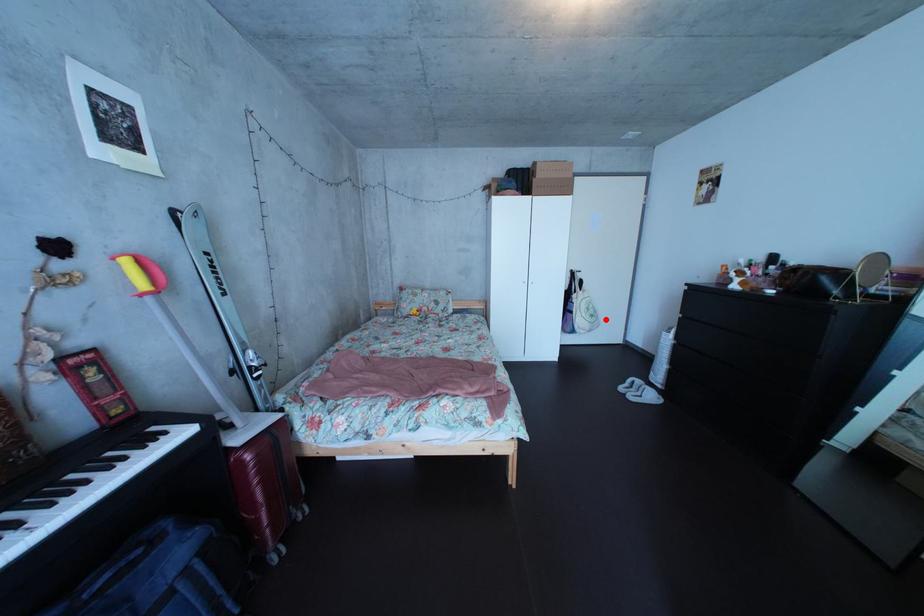
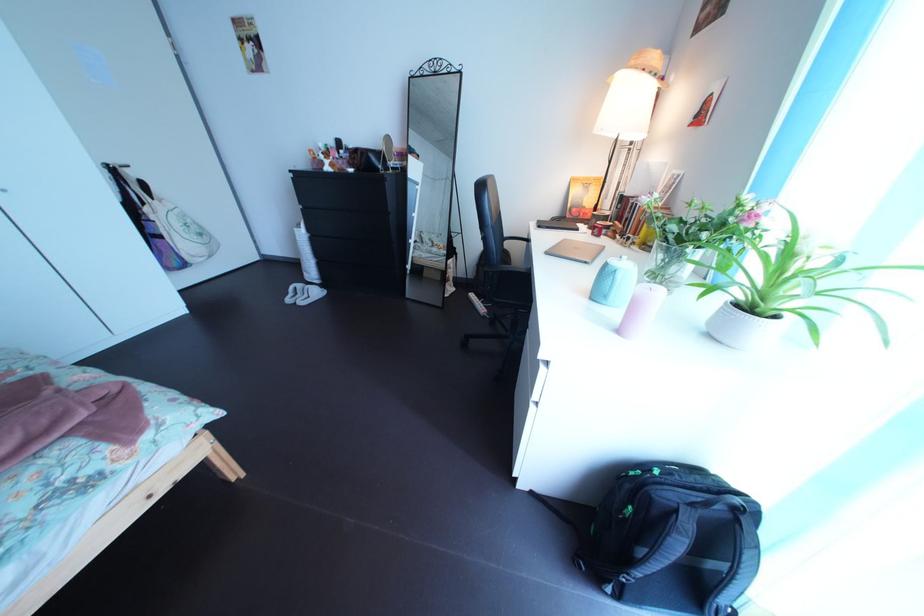
Question: I am providing you with two images of the same scene from different viewpoints. Image1 has a red point marked. In image2, the corresponding 3D location appears at what relative position? Reply with the corresponding letter.

Choices:
 (A) Closer
 (B) Farther

Answer: (A)